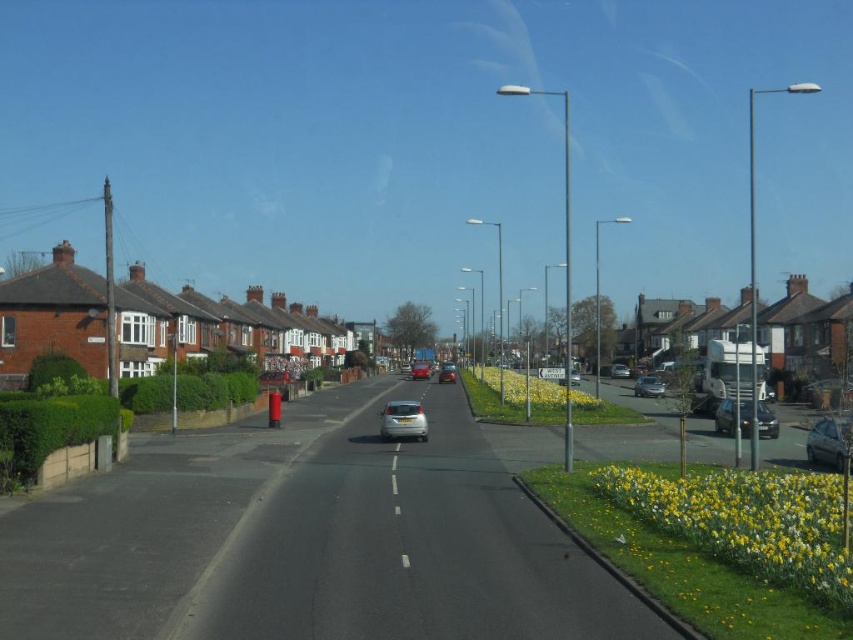
You are standing on the sidewalk of the suburban street scene and want to walk to both the point at coordinates (421, 417) and the point at coordinates (619, 364). Which point will you reach first?

You will reach the point at coordinates (421, 417) first because it is closer to you than the point at coordinates (619, 364).

You are a pedestrian standing at the edge of the road near the grassy area with yellow flowers. You want to cross the road to reach the terraced houses on the opposite side. The silver metallic hatchback at center is approaching you. If the car is traveling at 20 km per hour, will you have enough time to cross the road safely? Assume the road is 34.80 meters wide and you walk at 1.5 meters per second.

The road is 34.80 meters wide. To cross it at 1.5 meters per second, it would take 23.2 seconds. The car is approaching at 20 km per hour, which converts to approximately 5.56 meters per second. At this speed, the car would cover the 34.80 meters in about 6.25 seconds. Since the car reaches you much faster than your crossing time, it is unsafe to attempt crossing the road while the silver metallic hatchback at center is approaching.